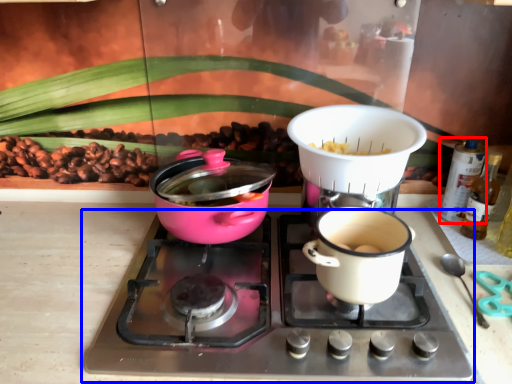
Question: Which object is closer to the camera taking this photo, bottle (highlighted by a red box) or gas stove (highlighted by a blue box)?

Choices:
 (A) bottle
 (B) gas stove

Answer: (B)